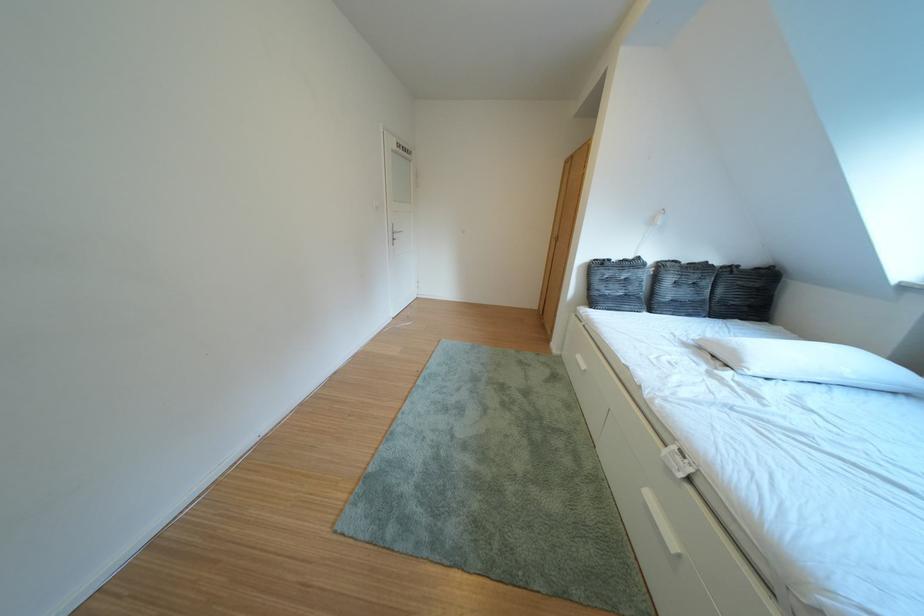
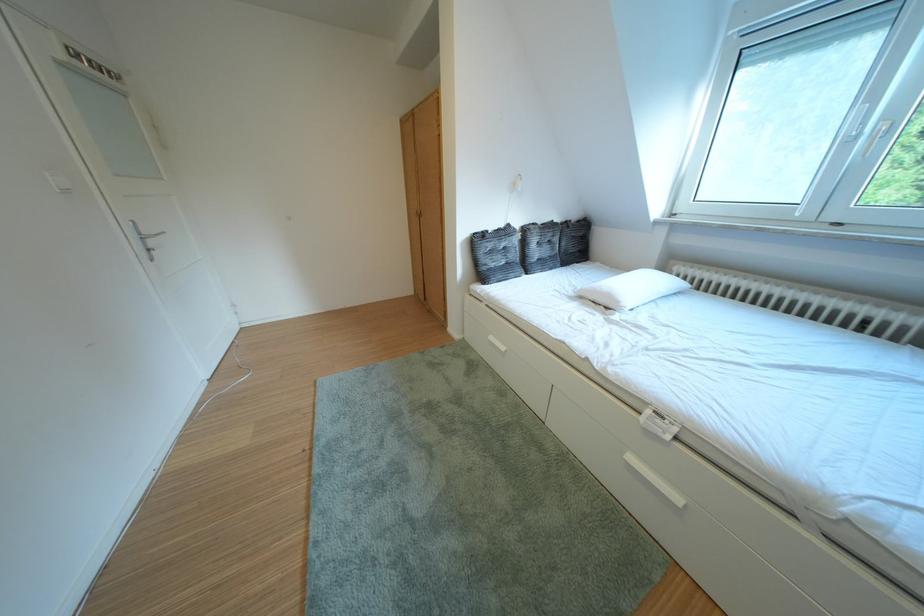
Locate, in the second image, the point that corresponds to pixel 662 500 in the first image.

(646, 464)